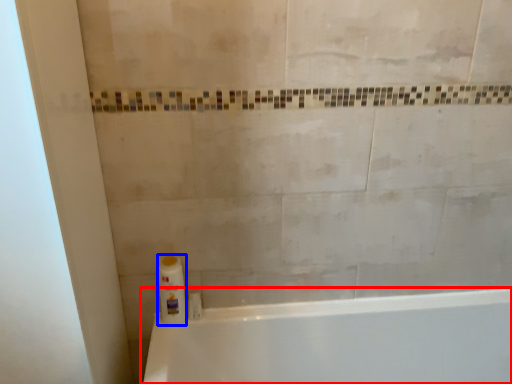
Question: Which of the following is the closest to the observer, bathtub (highlighted by a red box) or cleaning product (highlighted by a blue box)?

Choices:
 (A) bathtub
 (B) cleaning product

Answer: (A)